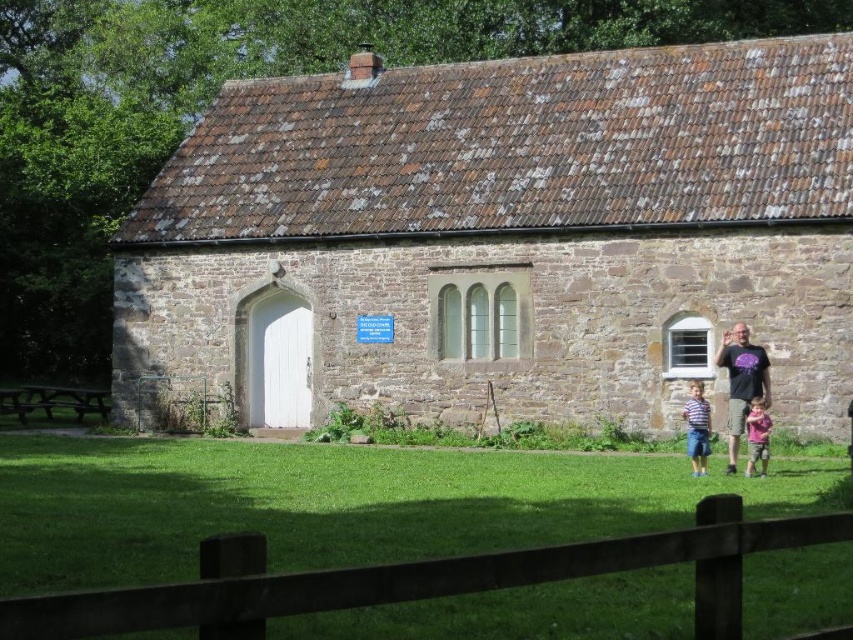
Question: Among these objects, which one is nearest to the camera?

Choices:
 (A) brown stone church at center
 (B) brown wooden fence at lower center
 (C) striped cotton shirt at lower right
 (D) pink cotton shirt at lower right

Answer: (B)

Question: Does brown stone church at center lie behind brown wooden fence at lower center?

Choices:
 (A) yes
 (B) no

Answer: (A)

Question: Does brown stone church at center lie in front of pink cotton shirt at lower right?

Choices:
 (A) no
 (B) yes

Answer: (A)

Question: Which object appears closest to the camera in this image?

Choices:
 (A) brown stone church at center
 (B) brown wooden fence at lower center

Answer: (B)

Question: Can you confirm if brown wooden fence at lower center is wider than pink cotton shirt at lower right?

Choices:
 (A) no
 (B) yes

Answer: (B)

Question: Which point appears farthest from the camera in this image?

Choices:
 (A) (712, 618)
 (B) (840, 182)
 (C) (755, 435)
 (D) (738, 332)

Answer: (B)